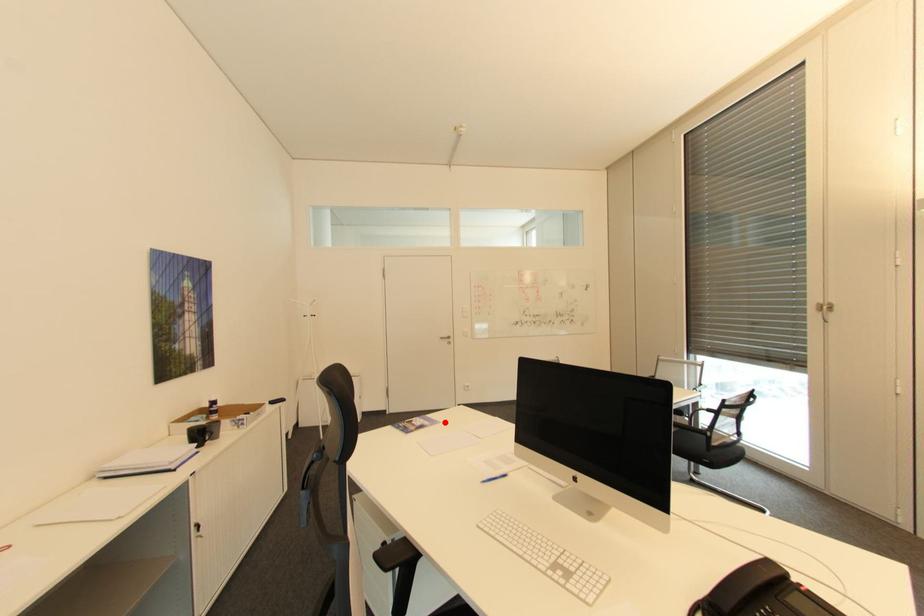
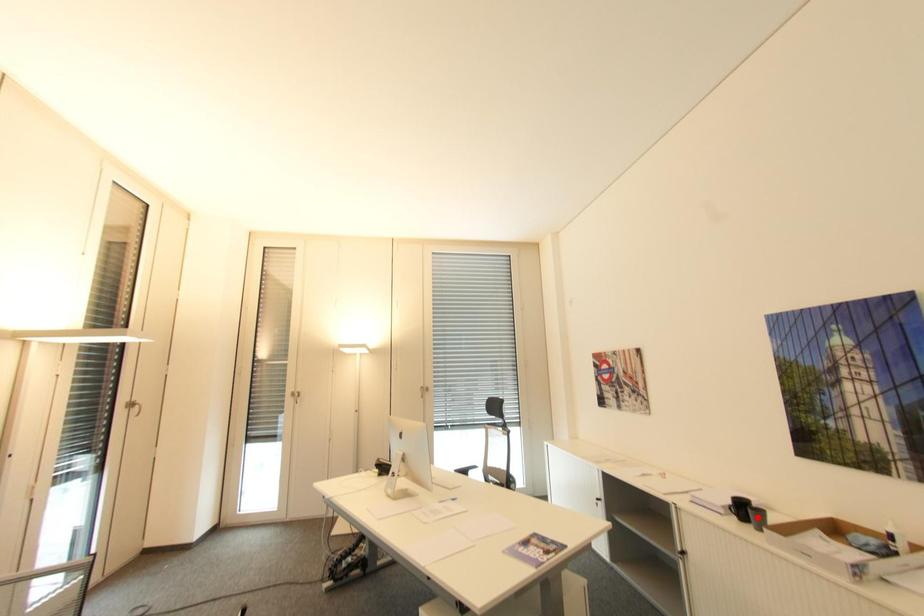
I am providing you with two images of the same scene from different viewpoints. A red point is marked on the first image and another point is marked on the second image. Is the marked point in image1 the same physical position as the marked point in image2?

No